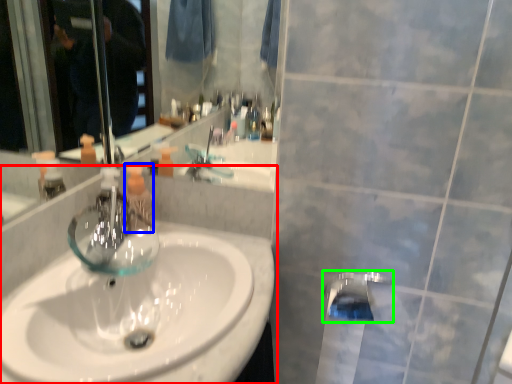
Question: Based on their relative distances, which object is nearer to sink (highlighted by a red box)? Choose from mouthwash (highlighted by a blue box) and tap (highlighted by a green box).

Choices:
 (A) mouthwash
 (B) tap

Answer: (A)